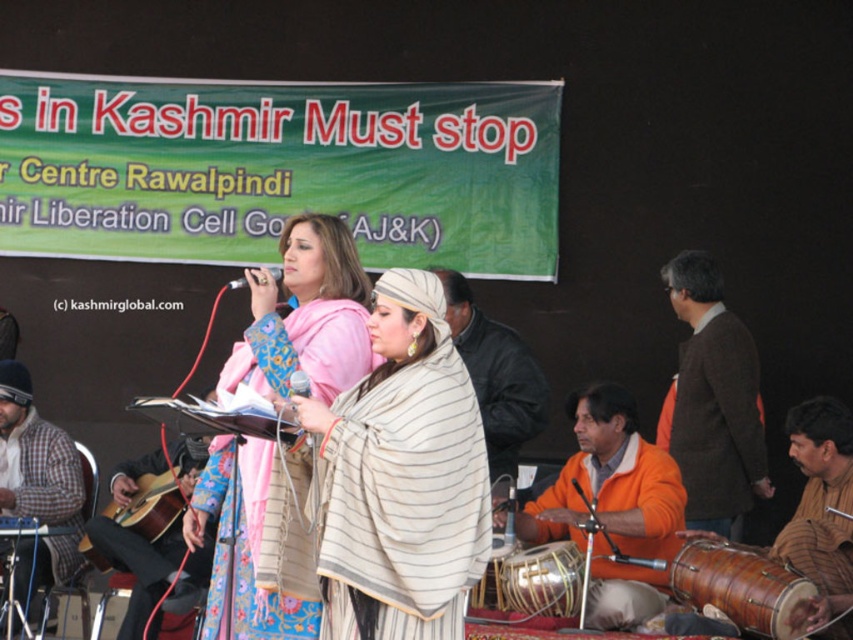
What is located at the point with coordinates (38, 484) in the image?

The plaid fabric shirt at lower left is located at point (38, 484).

You are a stagehand setting up for a performance. You need to place the brown textured drum at lower right and the acoustic wood guitar at lower left on a shelf. If the shelf can only hold items up to 30 cm in thickness, which item might not fit?

The acoustic wood guitar at lower left is thicker than the brown textured drum at lower right. Since the shelf can only hold items up to 30 cm in thickness, the acoustic wood guitar at lower left might not fit if its thickness exceeds 30 cm.

You are an event organizer setting up a stage for a performance. You have a plaid fabric shirt at lower left and a brown textured drum at lower right. Which object takes up more space on the stage?

The brown textured drum at lower right takes up more space on the stage than the plaid fabric shirt at lower left.